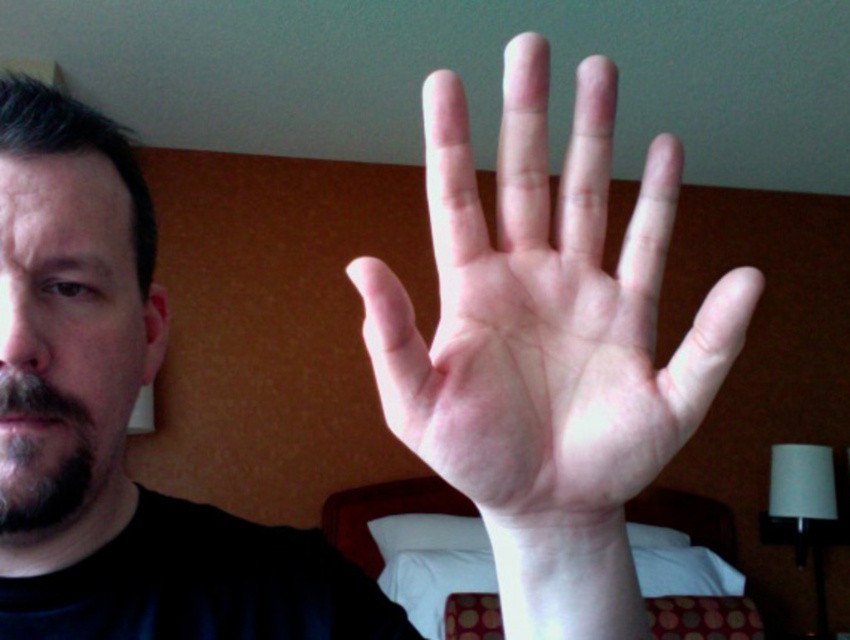
Question: Can you confirm if pale skin hand at center is smaller than white fabric bed at center?

Choices:
 (A) yes
 (B) no

Answer: (A)

Question: Which point appears farthest from the camera in this image?

Choices:
 (A) (x=9, y=454)
 (B) (x=397, y=506)
 (C) (x=686, y=374)

Answer: (B)

Question: Which object is positioned closest to the dark brown beard at left?

Choices:
 (A) pale skin hand at center
 (B) white fabric bed at center

Answer: (A)

Question: Estimate the real-world distances between objects in this image. Which object is closer to the white fabric bed at center?

Choices:
 (A) dark brown beard at left
 (B) pale skin hand at center

Answer: (B)

Question: Can you confirm if white fabric bed at center is positioned above dark brown beard at left?

Choices:
 (A) no
 (B) yes

Answer: (A)

Question: In this image, where is pale skin hand at center located relative to white fabric bed at center?

Choices:
 (A) above
 (B) below

Answer: (A)